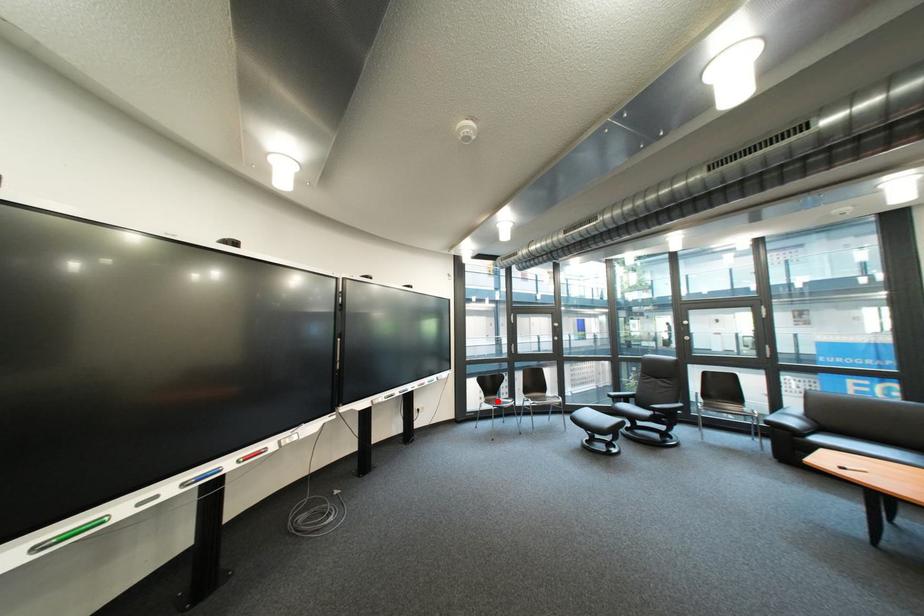
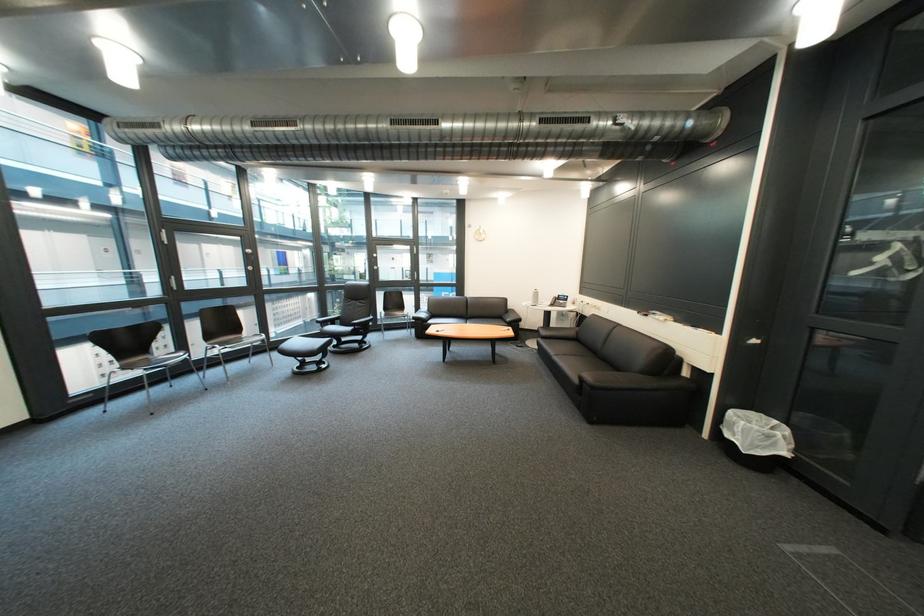
Question: I am providing you with two images of the same scene from different viewpoints. Given a red point in image1, look at the same physical point in image2. Is it:

Choices:
 (A) Closer to the viewpoint
 (B) Farther from the viewpoint

Answer: (A)